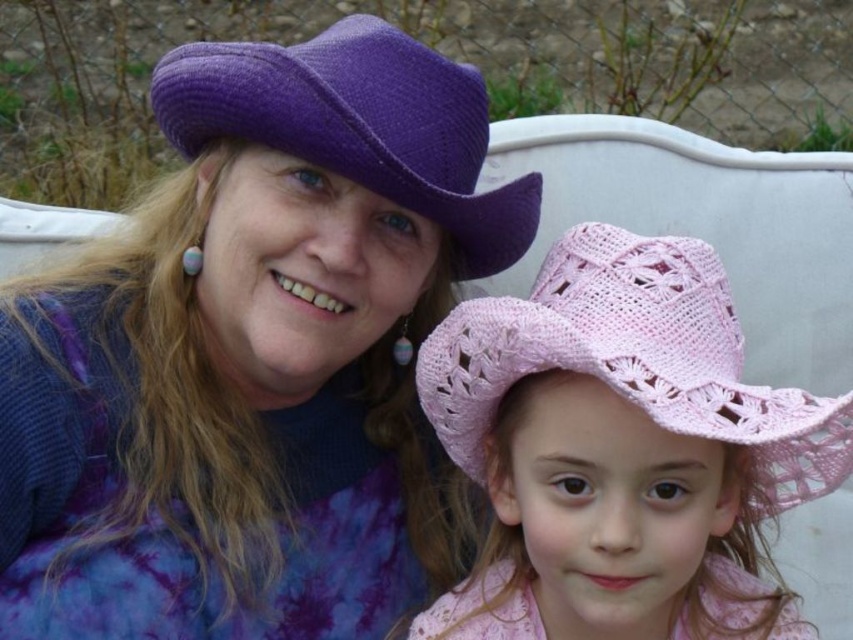
You are a photographer trying to capture the purple knitted hat at upper left in the center of your photo. What direction should you move your camera to achieve this?

To center the purple knitted hat at upper left, move your camera to the right and down because the hat is currently located at point [254,356], which is to the left and above the center of the frame.